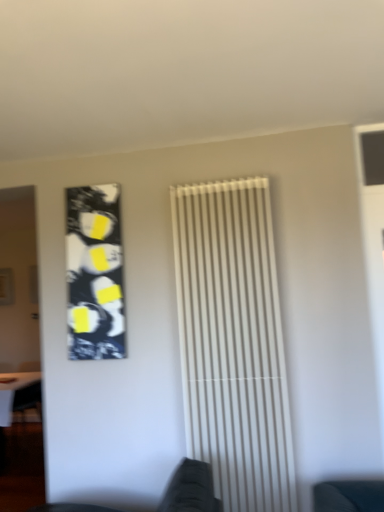
Question: Is white glossy table at lower left aimed at white matte radiator at center?

Choices:
 (A) yes
 (B) no

Answer: (B)

Question: Is white glossy table at lower left outside of white matte radiator at center?

Choices:
 (A) no
 (B) yes

Answer: (B)

Question: Is white glossy table at lower left taller than white matte radiator at center?

Choices:
 (A) yes
 (B) no

Answer: (B)

Question: Considering the relative sizes of white glossy table at lower left and white matte radiator at center in the image provided, is white glossy table at lower left smaller than white matte radiator at center?

Choices:
 (A) yes
 (B) no

Answer: (B)

Question: Is white glossy table at lower left looking in the opposite direction of white matte radiator at center?

Choices:
 (A) no
 (B) yes

Answer: (A)

Question: Does point pos(107,327) appear closer or farther from the camera than point pos(216,296)?

Choices:
 (A) closer
 (B) farther

Answer: (B)

Question: Do you think black and white abstract art at upper left is within white matte radiator at center, or outside of it?

Choices:
 (A) outside
 (B) inside

Answer: (A)

Question: Looking at the image, does black and white abstract art at upper left seem bigger or smaller compared to white matte radiator at center?

Choices:
 (A) small
 (B) big

Answer: (A)

Question: From the image's perspective, relative to white matte radiator at center, is black and white abstract art at upper left above or below?

Choices:
 (A) below
 (B) above

Answer: (B)

Question: Is white matte radiator at center inside the boundaries of white glossy table at lower left, or outside?

Choices:
 (A) inside
 (B) outside

Answer: (B)

Question: Looking at their shapes, would you say white matte radiator at center is wider or thinner than white glossy table at lower left?

Choices:
 (A) thin
 (B) wide

Answer: (A)

Question: Relative to white glossy table at lower left, is white matte radiator at center in front or behind?

Choices:
 (A) behind
 (B) front

Answer: (B)

Question: From a real-world perspective, relative to white glossy table at lower left, is white matte radiator at center vertically above or below?

Choices:
 (A) above
 (B) below

Answer: (A)

Question: Choose the correct answer: Is black and white abstract art at upper left inside white glossy table at lower left or outside it?

Choices:
 (A) outside
 (B) inside

Answer: (A)

Question: Looking at their shapes, would you say black and white abstract art at upper left is wider or thinner than white glossy table at lower left?

Choices:
 (A) thin
 (B) wide

Answer: (A)